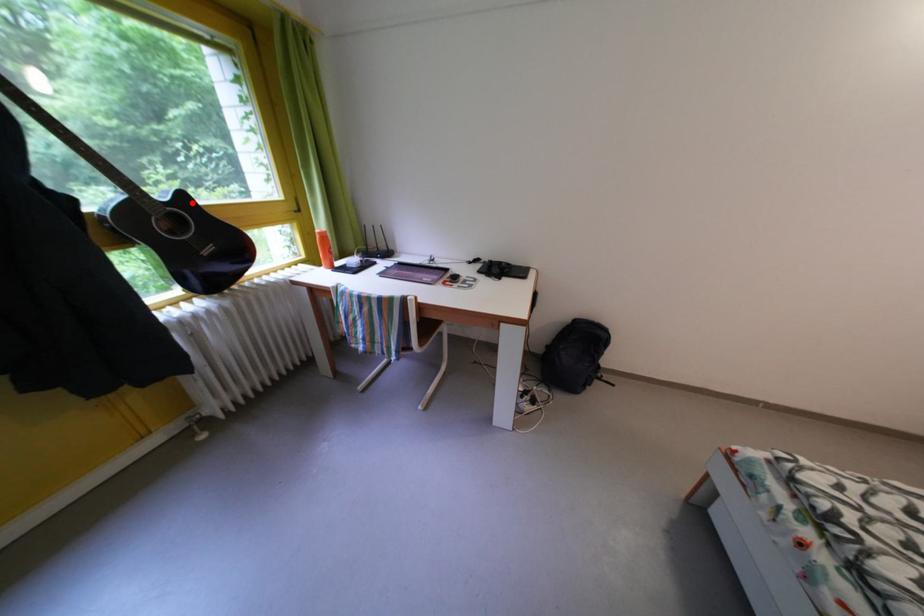
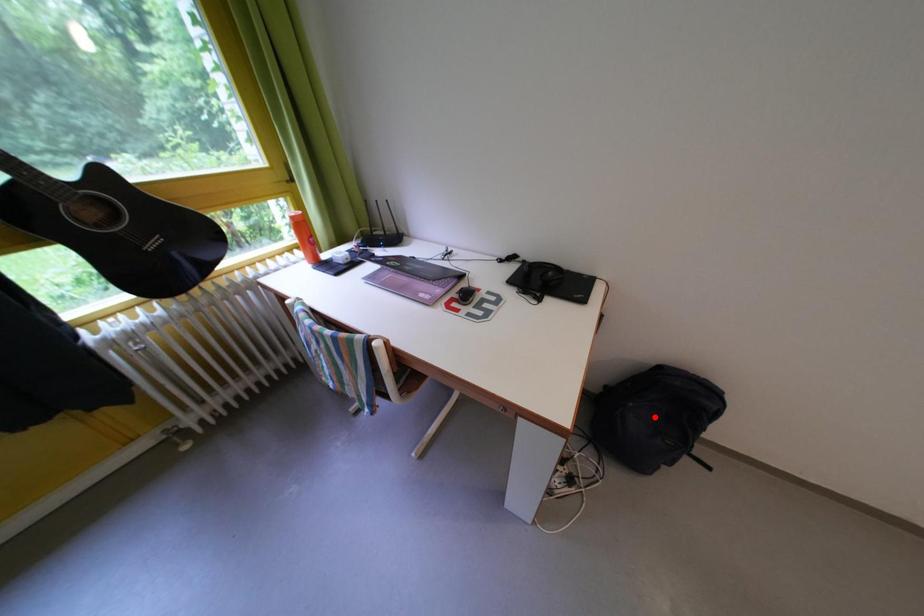
I am providing you with two images of the same scene from different viewpoints. A red point is marked on the first image and another point is marked on the second image. Are the points marked in image1 and image2 representing the same 3D position?

No